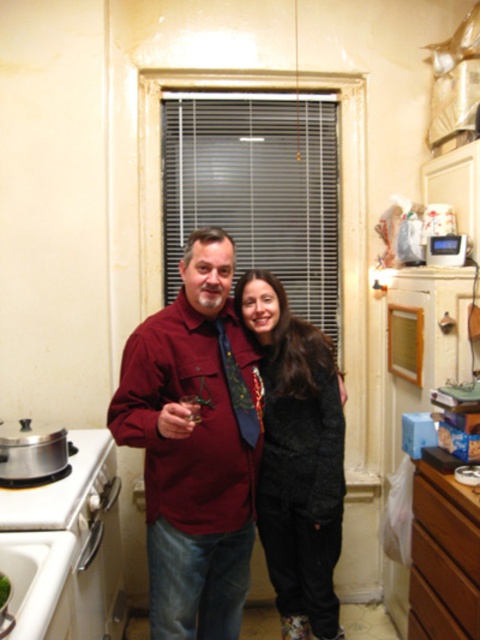
You are standing in the kitchen and want to place a new decorative item at the exact center of the room. The black fuzzy coat is already located at point (297, 458). Will placing the new item at the center interfere with the coat?

The black fuzzy coat at center is already located at point (297, 458), so placing the new item at the center would interfere with it.

You are standing in the kitchen and want to place a small decoration between the two points labeled as point (206, 544) and point (452, 536). Based on their positions, which point should the decoration be closer to in order to be in front of both?

The decoration should be closer to point (452, 536) because it is in front of point (206, 544).